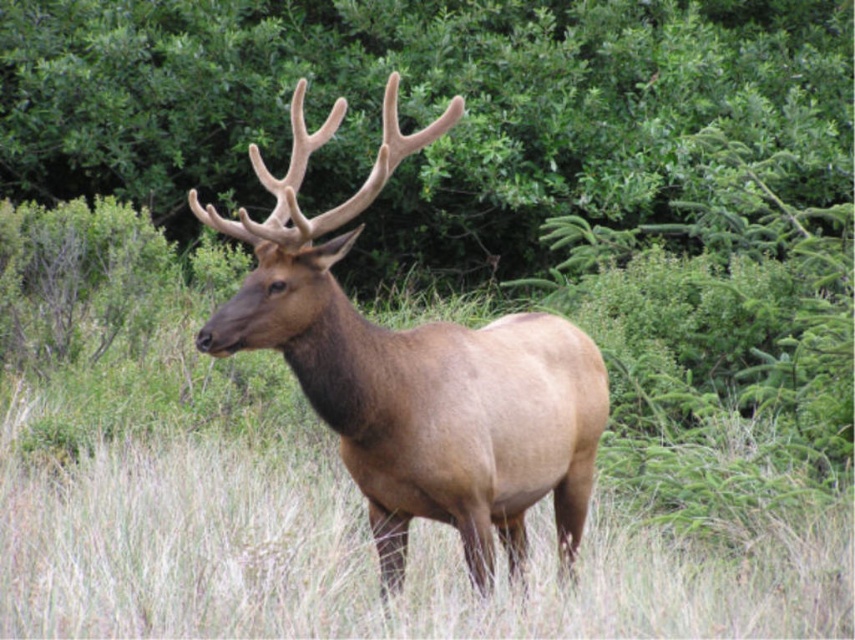
Question: Which point is closer to the camera?

Choices:
 (A) (334, 308)
 (B) (115, 116)

Answer: (A)

Question: Is green leafy tree at center smaller than brown velvet deer at center?

Choices:
 (A) no
 (B) yes

Answer: (B)

Question: Among these objects, which one is farthest from the camera?

Choices:
 (A) brown velvet deer at center
 (B) green leafy tree at center

Answer: (B)

Question: Is green leafy tree at center thinner than brown velvet deer at center?

Choices:
 (A) no
 (B) yes

Answer: (B)

Question: From the image, what is the correct spatial relationship of green leafy tree at center in relation to brown velvet deer at center?

Choices:
 (A) left
 (B) right

Answer: (A)